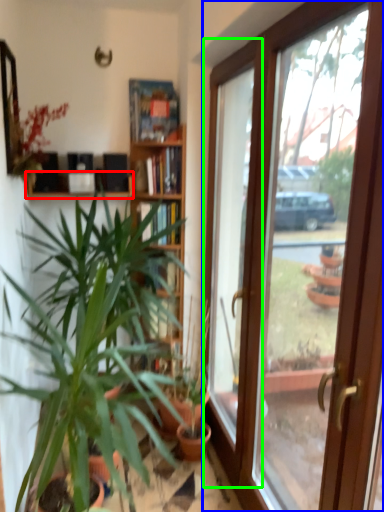
Question: Estimate the real-world distances between objects in this image. Which object is farther from shelf (highlighted by a red box), door (highlighted by a blue box) or window (highlighted by a green box)?

Choices:
 (A) door
 (B) window

Answer: (A)